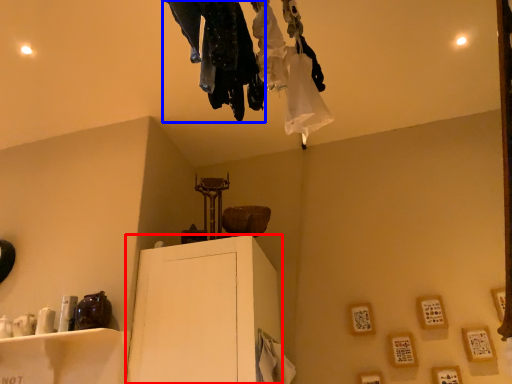
Question: Which object is further to the camera taking this photo, furniture (highlighted by a red box) or clothing (highlighted by a blue box)?

Choices:
 (A) furniture
 (B) clothing

Answer: (A)